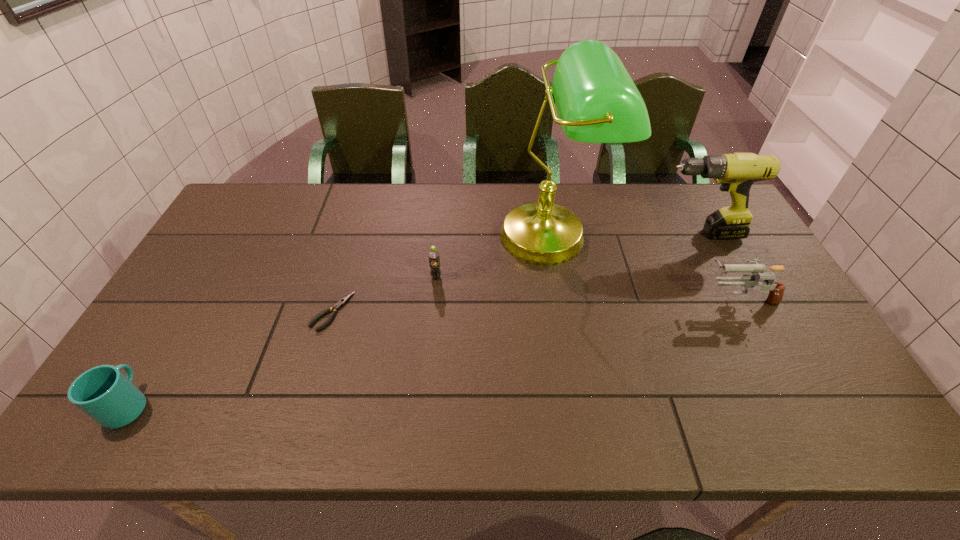
Image resolution: width=960 pixels, height=540 pixels. In order to click on unoccupied area between the tallest object and the pliers in this screenshot , I will do `click(443, 274)`.

You are a GUI agent. You are given a task and a screenshot of the screen. Output one action in this format:
    pyautogui.click(x=<x>, y=<y>)
    Task: Click on the unoccupied position between the second tallest object and the third tallest object
    Image resolution: width=960 pixels, height=540 pixels.
    Given the screenshot: What is the action you would take?
    pyautogui.click(x=718, y=266)

Where is `object that is the third closest to the lamp`? object that is the third closest to the lamp is located at coordinates (776, 289).

Choose which object is the fifth nearest neighbor to the lamp. Please provide its 2D coordinates. Your answer should be formatted as a tuple, i.e. [(x, y)], where the tuple contains the x and y coordinates of a point satisfying the conditions above.

[(104, 393)]